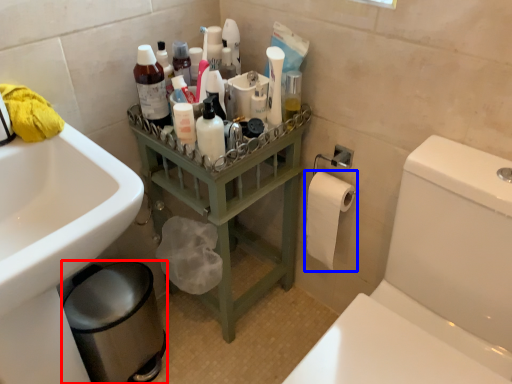
Question: Which object appears farthest to the camera in this image, bidet (highlighted by a red box) or toilet paper (highlighted by a blue box)?

Choices:
 (A) bidet
 (B) toilet paper

Answer: (B)